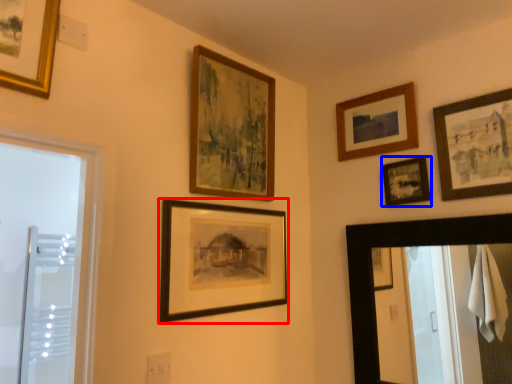
Question: Which object appears farthest to the camera in this image, picture frame (highlighted by a red box) or picture frame (highlighted by a blue box)?

Choices:
 (A) picture frame
 (B) picture frame

Answer: (B)